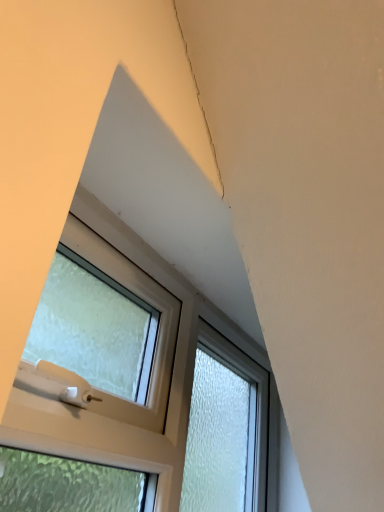
The height and width of the screenshot is (512, 384). I want to click on white plastic window at upper left, so click(169, 389).

The width and height of the screenshot is (384, 512). What do you see at coordinates (169, 389) in the screenshot?
I see `white plastic window at upper left` at bounding box center [169, 389].

In order to face white plastic window at upper left, should I rotate leftwards or rightwards?

Rotate right and turn 0.163 degrees.

At what (x,y) coordinates should I click in order to perform the action: click on white plastic window at upper left. Please return your answer as a coordinate pair (x, y). Looking at the image, I should click on (169, 389).